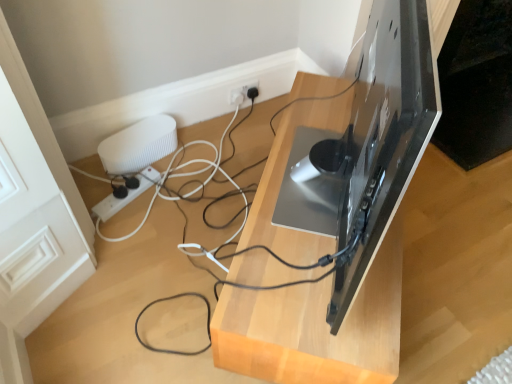
In order to click on vacant area on top of matte black tv stand at center (from a real-world perspective) in this screenshot , I will do `click(312, 203)`.